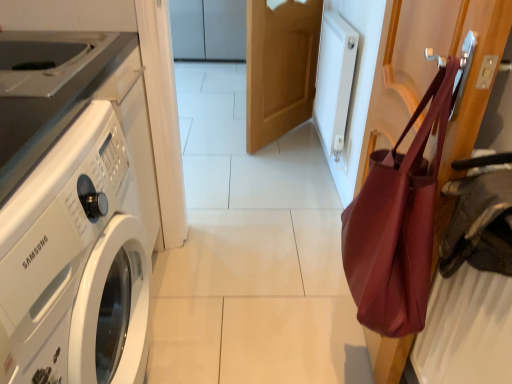
Identify the location of free region under light brown wood door at center (from a real-world perspective). (289, 134).